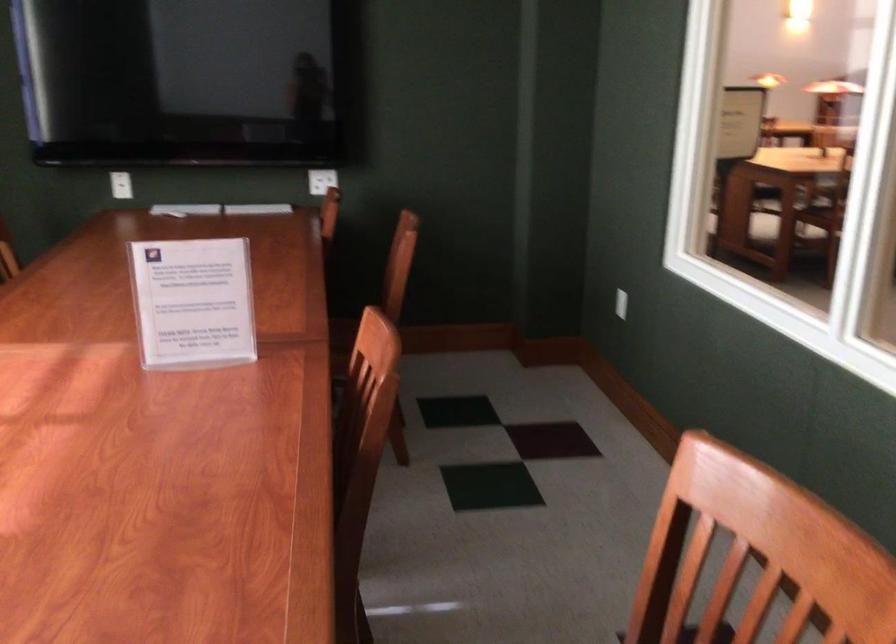
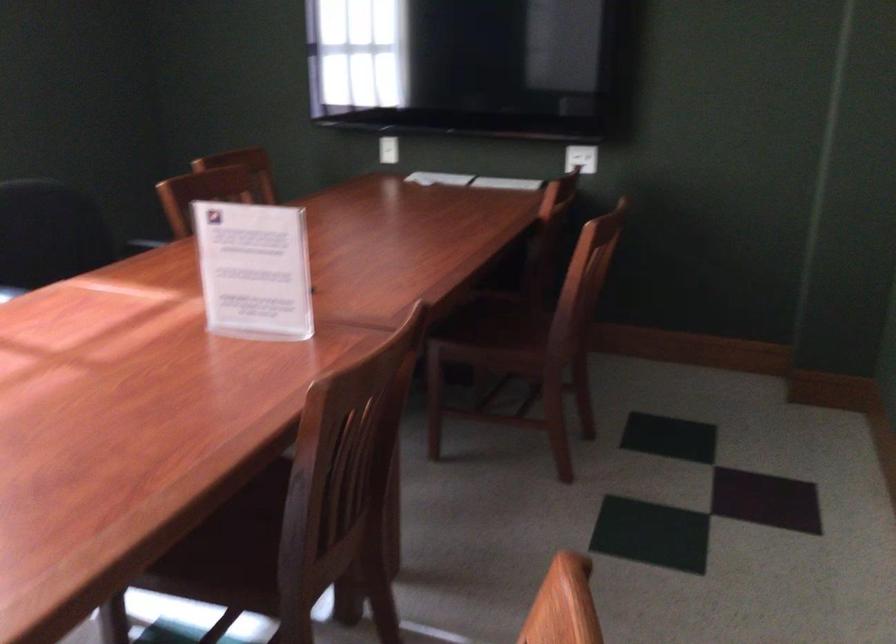
The images are taken continuously from a first-person perspective. In which direction are you moving?

The cameraman moved toward right, forward.